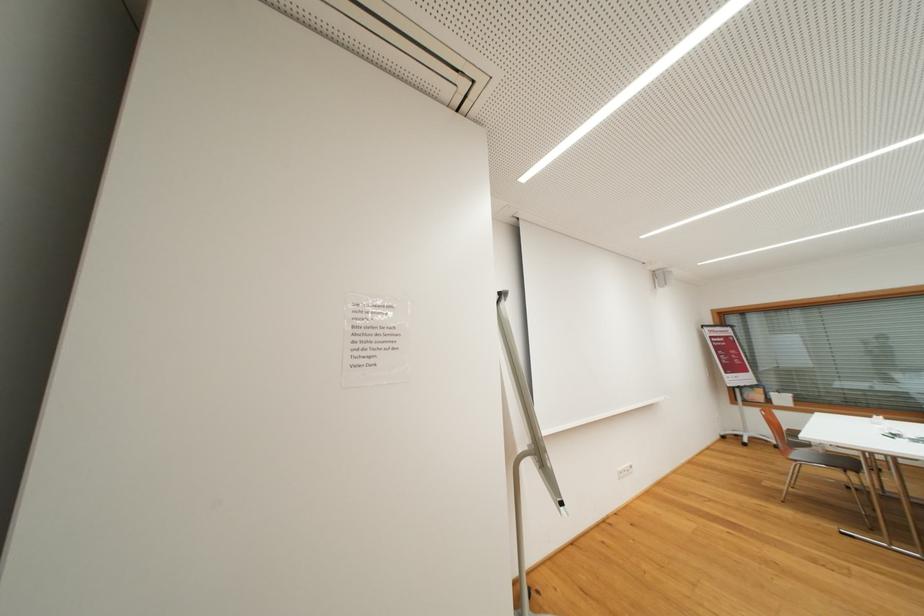
Where would you sit the chair sitting surface? Please return your answer as a coordinate pair (x, y).

(824, 459)